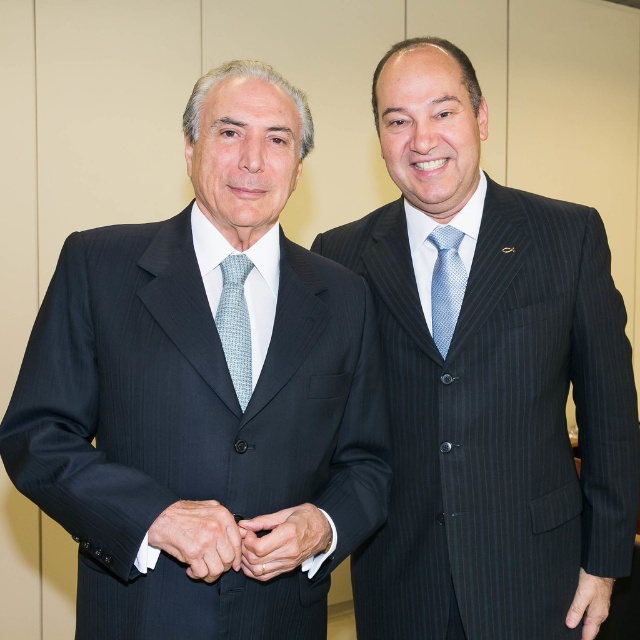
Measure the distance from light blue textured tie at center to light blue dotted tie at right.

light blue textured tie at center and light blue dotted tie at right are 18.65 inches apart.

Is light blue textured tie at center positioned in front of light blue dotted tie at right?

Yes, it is.

Is point (227, 307) positioned before point (435, 305)?

Yes, it is.

Locate an element on the screen. This screenshot has width=640, height=640. light blue textured tie at center is located at coordinates (236, 324).

Consider the image. Between pinstriped suit at right and matte black suit at lower right, which one has less height?

matte black suit at lower right is shorter.

Can you confirm if pinstriped suit at right is positioned above matte black suit at lower right?

Indeed, pinstriped suit at right is positioned over matte black suit at lower right.

What do you see at coordinates (486, 381) in the screenshot? This screenshot has width=640, height=640. I see `pinstriped suit at right` at bounding box center [486, 381].

What are the coordinates of `pinstriped suit at right` in the screenshot? It's located at pyautogui.click(x=486, y=381).

Who is taller, matte black suit at left or white satin cufflinks at center?

With more height is matte black suit at left.

Is point (182, 429) closer to viewer compared to point (280, 552)?

No.

Is point (36, 496) positioned before point (244, 554)?

No.

Image resolution: width=640 pixels, height=640 pixels. Find the location of `matte black suit at left`. matte black suit at left is located at coordinates (202, 385).